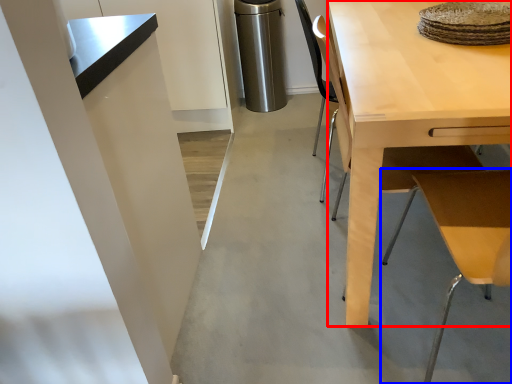
Question: Which point is closer to the camera, desk (highlighted by a red box) or table (highlighted by a blue box)?

Choices:
 (A) desk
 (B) table

Answer: (B)